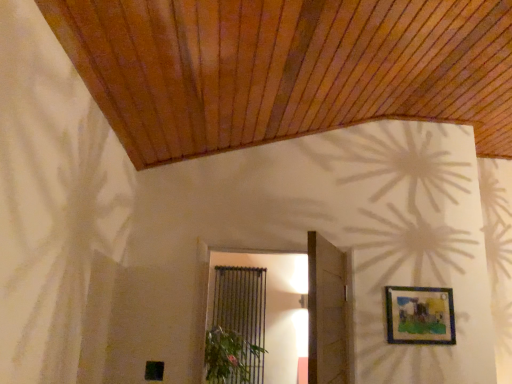
Question: Based on their sizes in the image, would you say wooden door at center is bigger or smaller than green leafy plant at lower center?

Choices:
 (A) big
 (B) small

Answer: (A)

Question: Looking at their shapes, would you say wooden door at center is wider or thinner than green leafy plant at lower center?

Choices:
 (A) thin
 (B) wide

Answer: (A)

Question: Estimate the real-world distances between objects in this image. Which object is closer to the green leafy plant at lower center?

Choices:
 (A) black metal screen door at center
 (B) wooden door at center
 (C) matte blue picture frame at upper right

Answer: (B)

Question: Which object is positioned farthest from the black metal screen door at center?

Choices:
 (A) green leafy plant at lower center
 (B) matte blue picture frame at upper right
 (C) wooden door at center

Answer: (C)